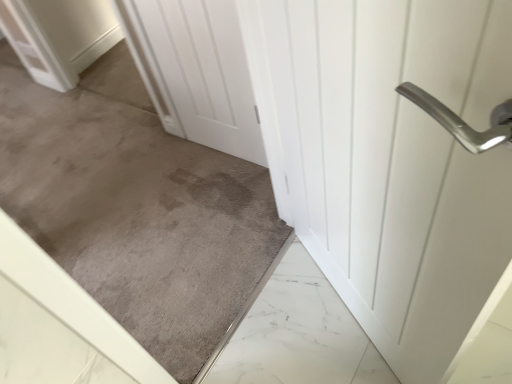
In order to click on gray carpet at center in this screenshot , I will do `click(135, 207)`.

Consider the image. From the image's perspective, is white matte door at center, the 2th door positioned from the right, over white glossy door handle at upper right, the second door when ordered from left to right?

Indeed, from the image's perspective, white matte door at center, the 2th door positioned from the right, is shown above white glossy door handle at upper right, the second door when ordered from left to right.

Does white matte door at center, arranged as the 1th door when viewed from the left, contain white glossy door handle at upper right, the first door when ordered from right to left?

No, white matte door at center, arranged as the 1th door when viewed from the left, does not contain white glossy door handle at upper right, the first door when ordered from right to left.

Which object is further away from the camera, white matte door at center, arranged as the 1th door when viewed from the left, or white glossy door handle at upper right, the second door when ordered from left to right?

white matte door at center, arranged as the 1th door when viewed from the left, is behind.

Which is in front, point (103, 156) or point (170, 11)?

The point (170, 11) is in front.

From the image's perspective, which one is positioned higher, gray carpet at center or white matte door at center, arranged as the 1th door when viewed from the left?

white matte door at center, arranged as the 1th door when viewed from the left, is shown above in the image.

Considering the relative sizes of gray carpet at center and white matte door at center, arranged as the 1th door when viewed from the left, in the image provided, is gray carpet at center smaller than white matte door at center, arranged as the 1th door when viewed from the left,?

No, gray carpet at center is not smaller than white matte door at center, arranged as the 1th door when viewed from the left.

Is the surface of gray carpet at center in direct contact with white matte door at center, the 2th door positioned from the right?

No, gray carpet at center is not with white matte door at center, the 2th door positioned from the right.

Does white glossy door handle at upper right, the second door when ordered from left to right, contain white matte door at center, arranged as the 1th door when viewed from the left?

No, white matte door at center, arranged as the 1th door when viewed from the left, is not inside white glossy door handle at upper right, the second door when ordered from left to right.

In the scene shown: From the image's perspective, does white glossy door handle at upper right, the second door when ordered from left to right, appear higher than white matte door at center, the 2th door positioned from the right?

No, from the image's perspective, white glossy door handle at upper right, the second door when ordered from left to right, is not above white matte door at center, the 2th door positioned from the right.

Between white glossy door handle at upper right, the first door when ordered from right to left, and white matte door at center, arranged as the 1th door when viewed from the left, which one is positioned behind?

white matte door at center, arranged as the 1th door when viewed from the left, is further away from the camera.

Is white matte door at center, arranged as the 1th door when viewed from the left, at the back of white glossy door handle at upper right, the first door when ordered from right to left?

That's not correct — white glossy door handle at upper right, the first door when ordered from right to left, is not looking away from white matte door at center, arranged as the 1th door when viewed from the left.

Is gray carpet at center facing towards white glossy door handle at upper right, the first door when ordered from right to left?

Yes, gray carpet at center faces towards white glossy door handle at upper right, the first door when ordered from right to left.

Considering the sizes of objects gray carpet at center and white glossy door handle at upper right, the first door when ordered from right to left, in the image provided, who is taller, gray carpet at center or white glossy door handle at upper right, the first door when ordered from right to left,?

Standing taller between the two is gray carpet at center.

From the image's perspective, is gray carpet at center positioned above or below white glossy door handle at upper right, the first door when ordered from right to left?

Based on their image positions, gray carpet at center is located above white glossy door handle at upper right, the first door when ordered from right to left.

Relative to white glossy door handle at upper right, the first door when ordered from right to left, is gray carpet at center in front or behind?

Clearly, gray carpet at center is behind white glossy door handle at upper right, the first door when ordered from right to left.

The height and width of the screenshot is (384, 512). Identify the location of door below the gray carpet at center (from the image's perspective). (390, 161).

Does white glossy door handle at upper right, the first door when ordered from right to left, appear on the right side of gray carpet at center?

Indeed, white glossy door handle at upper right, the first door when ordered from right to left, is positioned on the right side of gray carpet at center.

Looking at the image, does white glossy door handle at upper right, the first door when ordered from right to left, seem bigger or smaller compared to gray carpet at center?

Clearly, white glossy door handle at upper right, the first door when ordered from right to left, is larger in size than gray carpet at center.

Is white glossy door handle at upper right, the first door when ordered from right to left, facing away from gray carpet at center?

Yes, white glossy door handle at upper right, the first door when ordered from right to left, is positioned with its back facing gray carpet at center.

Which is more to the left, white matte door at center, the 2th door positioned from the right, or gray carpet at center?

Positioned to the left is white matte door at center, the 2th door positioned from the right.

Does white matte door at center, arranged as the 1th door when viewed from the left, come behind gray carpet at center?

Yes, it is.

In terms of size, does white matte door at center, the 2th door positioned from the right, appear bigger or smaller than gray carpet at center?

In the image, white matte door at center, the 2th door positioned from the right, appears to be smaller than gray carpet at center.

From a real-world perspective, is white matte door at center, the 2th door positioned from the right, positioned above or below gray carpet at center?

Clearly, from a real-world perspective, white matte door at center, the 2th door positioned from the right, is below gray carpet at center.

You are a GUI agent. You are given a task and a screenshot of the screen. Output one action in this format:
    pyautogui.click(x=<x>, y=<y>)
    Task: Click on the door that appears in front of the white matte door at center, arranged as the 1th door when viewed from the left
    The height and width of the screenshot is (384, 512).
    Given the screenshot: What is the action you would take?
    pyautogui.click(x=390, y=161)

At what (x,y) coordinates should I click in order to perform the action: click on door above the gray carpet at center (from the image's perspective). Please return your answer as a coordinate pair (x, y). The height and width of the screenshot is (384, 512). Looking at the image, I should click on (195, 71).

Based on their spatial positions, is white matte door at center, the 2th door positioned from the right, or gray carpet at center further from white glossy door handle at upper right, the first door when ordered from right to left?

Among the two, gray carpet at center is located further to white glossy door handle at upper right, the first door when ordered from right to left.

Consider the image. From the image, which object appears to be nearer to white glossy door handle at upper right, the first door when ordered from right to left, gray carpet at center or white matte door at center, the 2th door positioned from the right?

white matte door at center, the 2th door positioned from the right, lies closer to white glossy door handle at upper right, the first door when ordered from right to left, than the other object.

Based on their spatial positions, is white glossy door handle at upper right, the second door when ordered from left to right, or white matte door at center, arranged as the 1th door when viewed from the left, closer to gray carpet at center?

white matte door at center, arranged as the 1th door when viewed from the left, is closer to gray carpet at center.

When comparing their distances from gray carpet at center, does white matte door at center, arranged as the 1th door when viewed from the left, or white glossy door handle at upper right, the first door when ordered from right to left, seem closer?

white matte door at center, arranged as the 1th door when viewed from the left, lies closer to gray carpet at center than the other object.

Looking at the image, which one is located closer to white matte door at center, the 2th door positioned from the right, gray carpet at center or white glossy door handle at upper right, the first door when ordered from right to left?

Based on the image, gray carpet at center appears to be nearer to white matte door at center, the 2th door positioned from the right.

Which object lies nearer to the anchor point white matte door at center, the 2th door positioned from the right, white glossy door handle at upper right, the first door when ordered from right to left, or gray carpet at center?

The object closer to white matte door at center, the 2th door positioned from the right, is gray carpet at center.

Locate an element on the screen. Image resolution: width=512 pixels, height=384 pixels. concrete between white glossy door handle at upper right, the first door when ordered from right to left, and white matte door at center, arranged as the 1th door when viewed from the left, in the front-back direction is located at coordinates (135, 207).